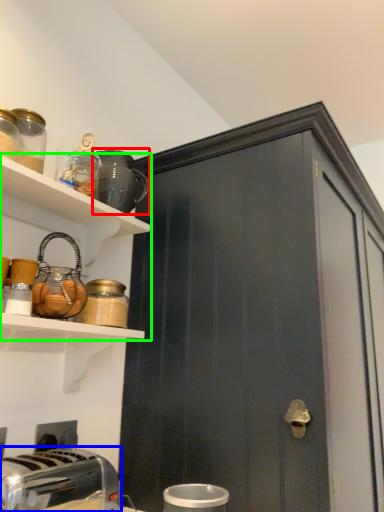
Question: Based on their relative distances, which object is farther from appliance (highlighted by a red box)? Choose from toaster (highlighted by a blue box) and shelf (highlighted by a green box).

Choices:
 (A) toaster
 (B) shelf

Answer: (A)